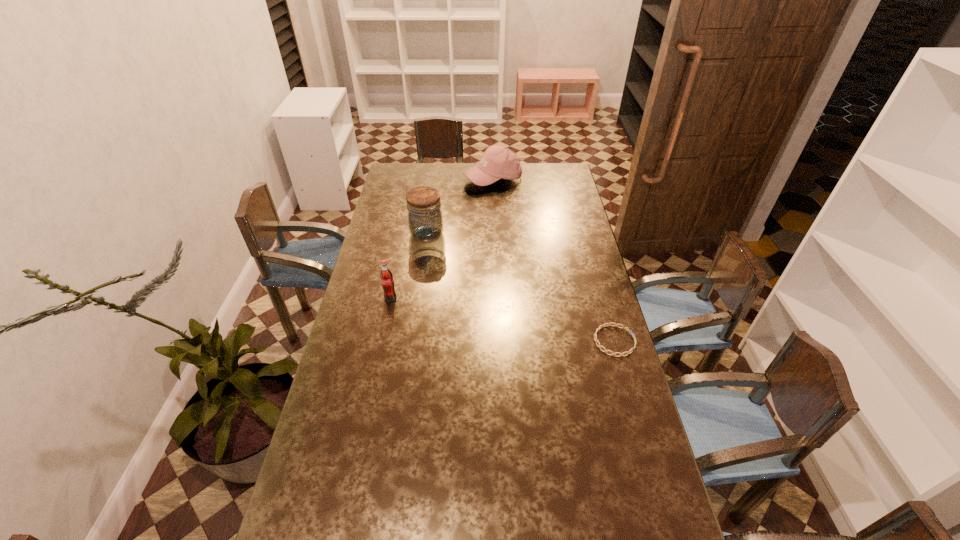
At what (x,y) coordinates should I click in order to perform the action: click on free space on the desktop that is between the third farthest object and the rightmost object and is positioned on the lid of the jar. Please return your answer as a coordinate pair (x, y). Looking at the image, I should click on [x=496, y=318].

This screenshot has height=540, width=960. Identify the location of free space on the desktop that is between the soda bottle and the bracelet and is positioned on the front-facing side of the third object from left to right. click(x=485, y=316).